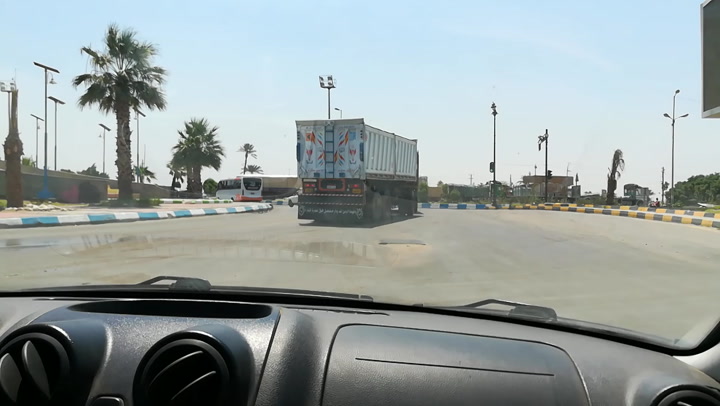
You are a GUI agent. You are given a task and a screenshot of the screen. Output one action in this format:
    pyautogui.click(x=<x>, y=<y>)
    Task: Click on the wall
    
    Given the screenshot: What is the action you would take?
    pyautogui.click(x=30, y=189), pyautogui.click(x=57, y=189), pyautogui.click(x=102, y=183)